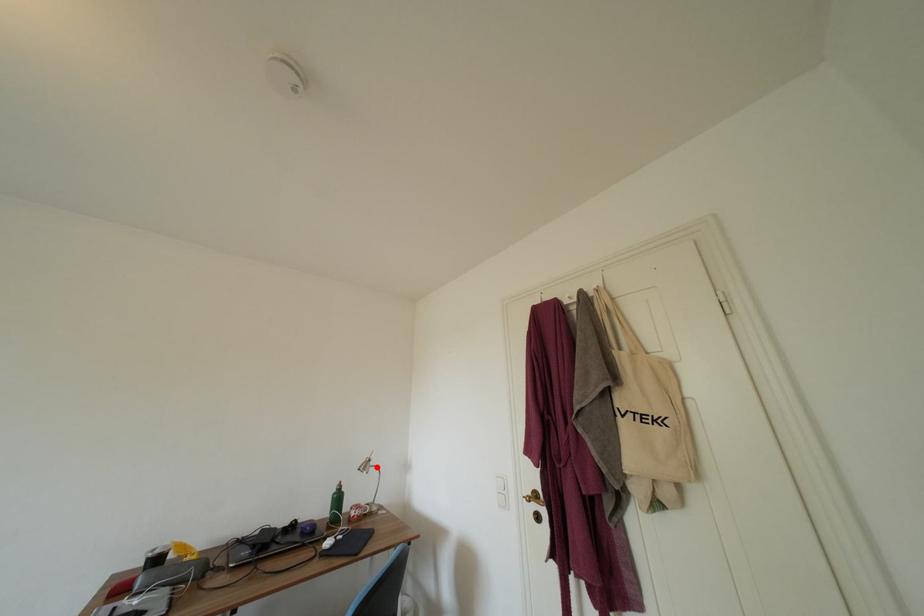
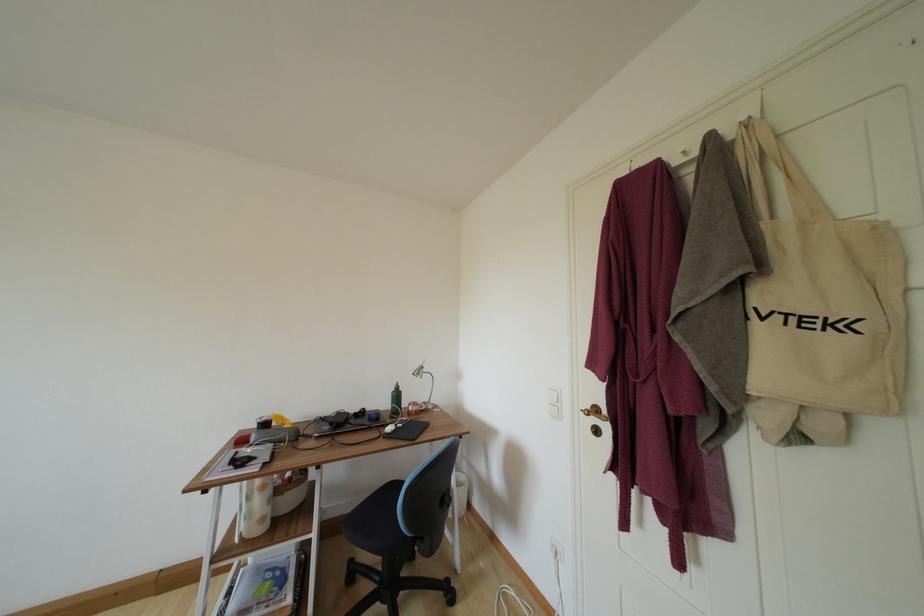
Where in the second image is the point corresponding to the highlighted location from the first image?

(430, 374)